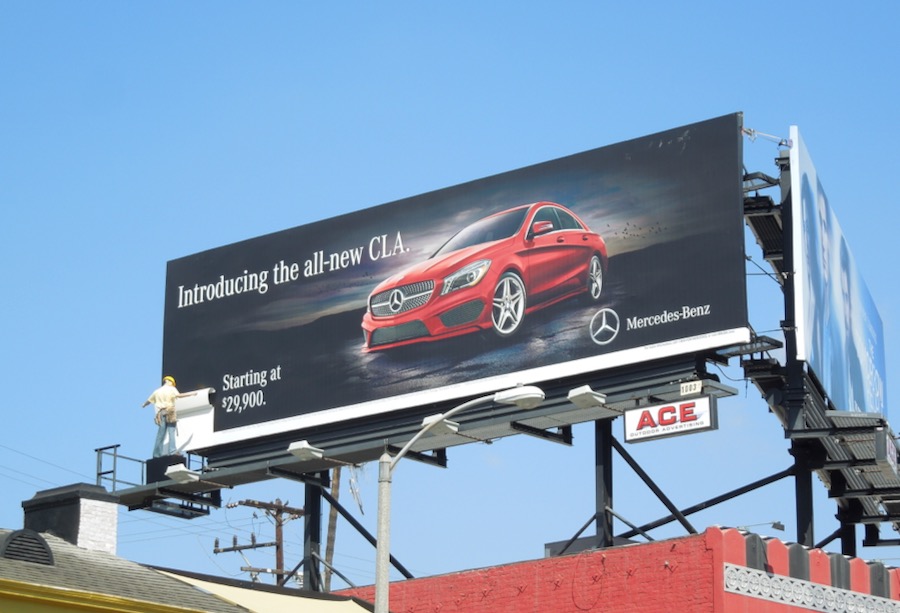
What are the coordinates of `lights` in the screenshot? It's located at (183, 473), (301, 449), (443, 428), (580, 403), (527, 401).